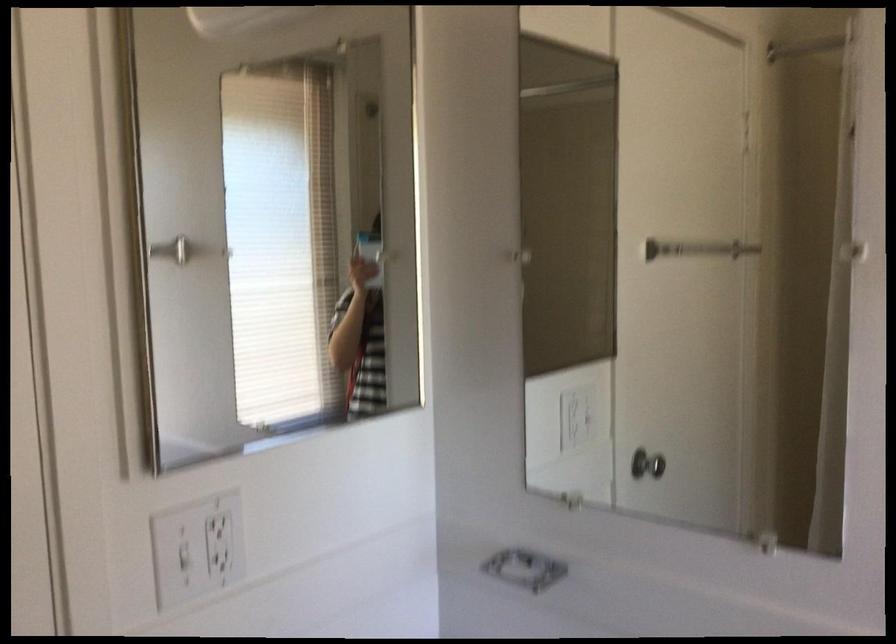
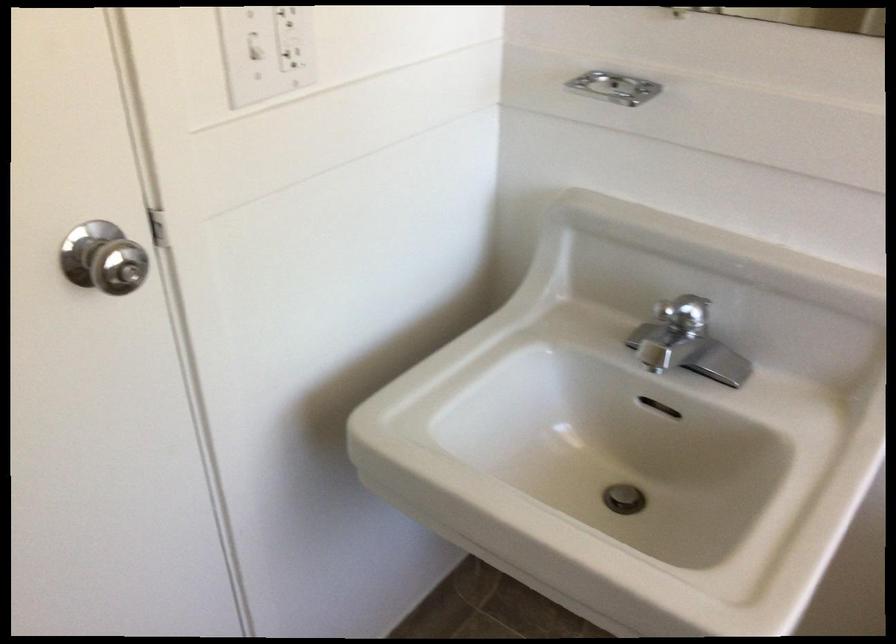
The point at (530, 569) is marked in the first image. Where is the corresponding point in the second image?

(615, 87)